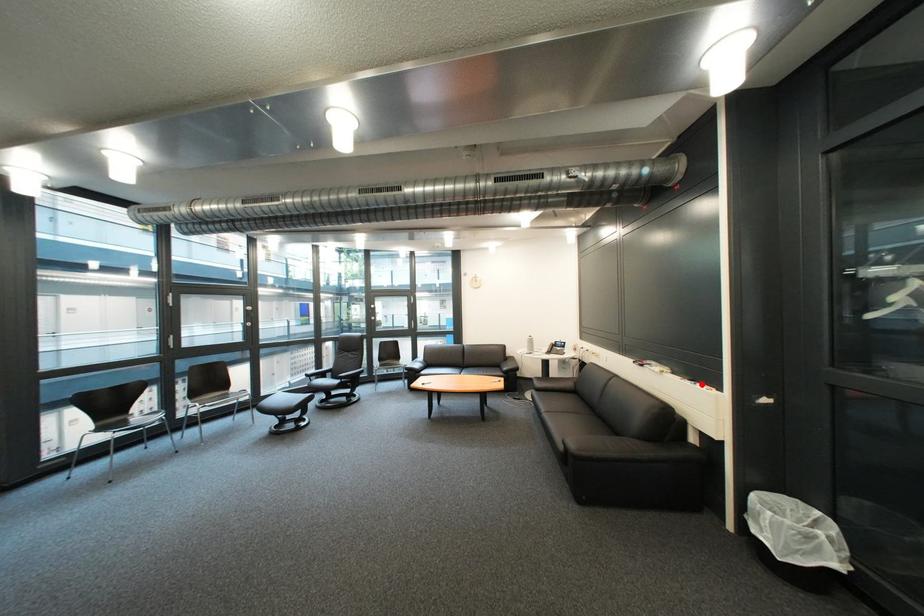
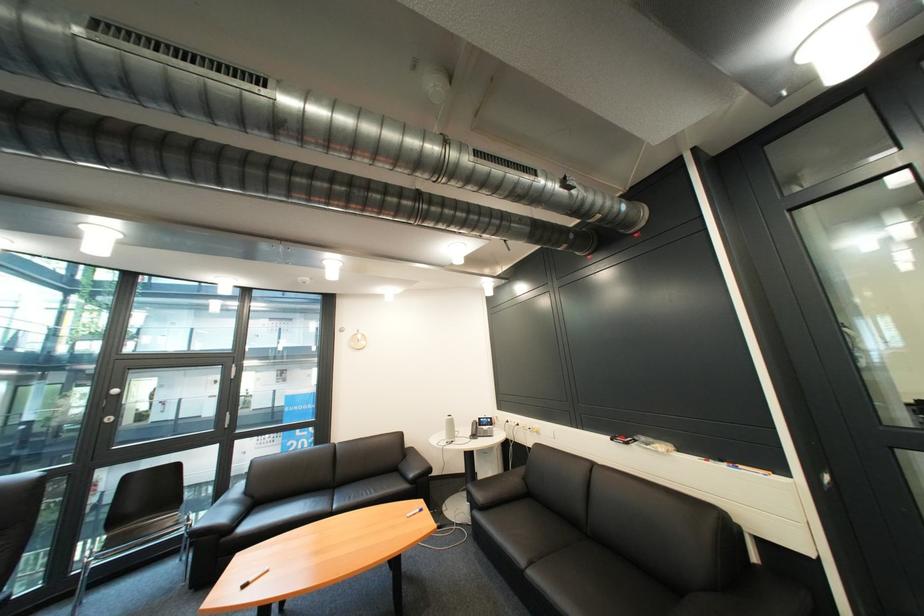
In the second image, find the point that corresponds to the highlighted location in the first image.

(736, 468)